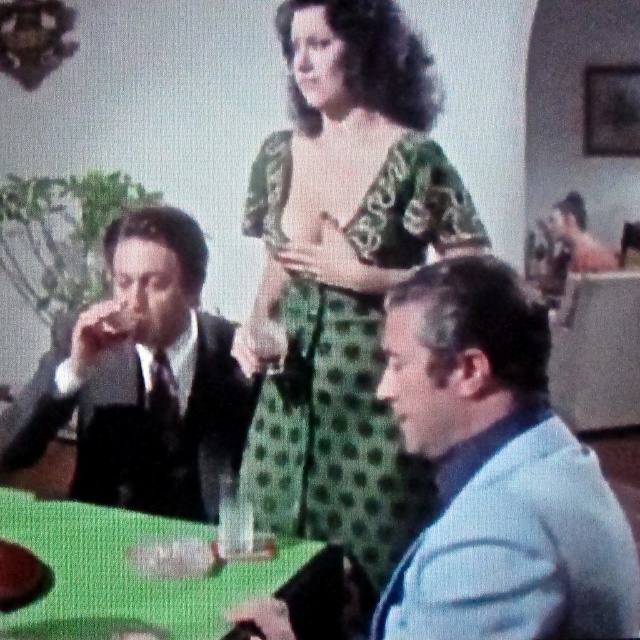
You are a photographer setting up a shoot in this scene. You need to place a spotlight on the green dotted fabric dress at center without it casting a shadow on the shiny black suit at left. Is this possible given their positions?

The green dotted fabric dress at center is positioned over the shiny black suit at left, so placing a spotlight on the green dotted fabric dress at center would cast a shadow on the shiny black suit at left. Therefore, it is not possible to avoid casting a shadow on the shiny black suit at left.

What is the coordinate of the light blue fabric jacket at center?

The light blue fabric jacket at center is located at coordinate point [497,472].